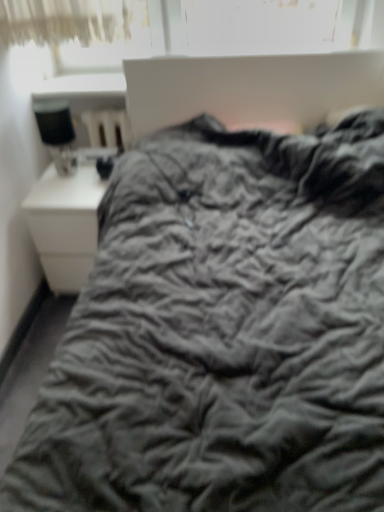
At what (x,y) coordinates should I click in order to perform the action: click on vacant area on top of white glossy nightstand at left (from a real-world perspective). Please return your answer as a coordinate pair (x, y). This screenshot has width=384, height=512. Looking at the image, I should click on (82, 173).